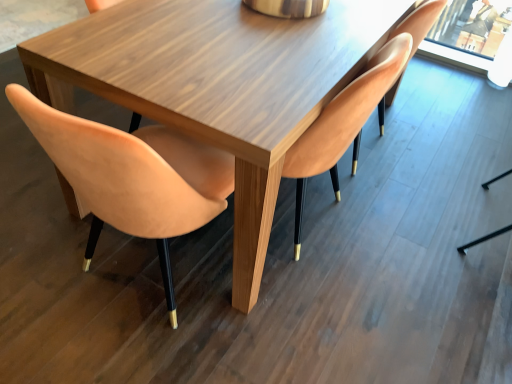
Question: Considering the relative sizes of suede-like peach chair at left, which ranks as the third chair in right-to-left order, and matte wood chair at center, the 2th chair positioned from the left, in the image provided, is suede-like peach chair at left, which ranks as the third chair in right-to-left order, taller than matte wood chair at center, the 2th chair positioned from the left,?

Choices:
 (A) no
 (B) yes

Answer: (A)

Question: Is suede-like peach chair at left, which is counted as the first chair, starting from the left, aimed at matte wood chair at center, the 2th chair positioned from the left?

Choices:
 (A) no
 (B) yes

Answer: (B)

Question: Is suede-like peach chair at left, which is counted as the first chair, starting from the left, to the right of matte wood chair at center, the 2th chair positioned from the left, from the viewer's perspective?

Choices:
 (A) no
 (B) yes

Answer: (A)

Question: Is suede-like peach chair at left, which is counted as the first chair, starting from the left, not within matte wood chair at center, the 2th chair positioned from the left?

Choices:
 (A) yes
 (B) no

Answer: (A)

Question: Does suede-like peach chair at left, which is counted as the first chair, starting from the left, have a smaller size compared to matte wood chair at center, the 2th chair positioned from the left?

Choices:
 (A) yes
 (B) no

Answer: (A)

Question: From a real-world perspective, is matte wood chair at center, the 2th chair positioned from the left, above or below suede-like peach chair at left, which is counted as the first chair, starting from the left?

Choices:
 (A) above
 (B) below

Answer: (A)

Question: Choose the correct answer: Is matte wood chair at center, which is the 2th chair from right to left, inside suede-like peach chair at left, which ranks as the third chair in right-to-left order, or outside it?

Choices:
 (A) inside
 (B) outside

Answer: (B)

Question: Considering the positions of matte wood chair at center, the 2th chair positioned from the left, and suede-like peach chair at left, which is counted as the first chair, starting from the left, in the image, is matte wood chair at center, the 2th chair positioned from the left, bigger or smaller than suede-like peach chair at left, which is counted as the first chair, starting from the left,?

Choices:
 (A) big
 (B) small

Answer: (A)

Question: In the image, is matte wood chair at center, which is the 2th chair from right to left, on the left side or the right side of suede-like peach chair at left, which is counted as the first chair, starting from the left?

Choices:
 (A) left
 (B) right

Answer: (B)

Question: From a real-world perspective, is matte orange chair at upper right, arranged as the 1th chair when viewed from the right, physically located above or below suede-like peach chair at left, which ranks as the third chair in right-to-left order?

Choices:
 (A) above
 (B) below

Answer: (B)

Question: From the image's perspective, is matte orange chair at upper right, arranged as the 1th chair when viewed from the right, above or below suede-like peach chair at left, which ranks as the third chair in right-to-left order?

Choices:
 (A) below
 (B) above

Answer: (B)

Question: Looking at their shapes, would you say matte orange chair at upper right, arranged as the 1th chair when viewed from the right, is wider or thinner than suede-like peach chair at left, which ranks as the third chair in right-to-left order?

Choices:
 (A) thin
 (B) wide

Answer: (A)

Question: Looking at the image, does matte orange chair at upper right, the 3th chair in the left-to-right sequence, seem bigger or smaller compared to suede-like peach chair at left, which is counted as the first chair, starting from the left?

Choices:
 (A) big
 (B) small

Answer: (B)

Question: Based on their sizes in the image, would you say matte wood chair at center, which is the 2th chair from right to left, is bigger or smaller than matte orange chair at upper right, the 3th chair in the left-to-right sequence?

Choices:
 (A) big
 (B) small

Answer: (A)

Question: Considering their positions, is matte wood chair at center, the 2th chair positioned from the left, located in front of or behind matte orange chair at upper right, the 3th chair in the left-to-right sequence?

Choices:
 (A) behind
 (B) front

Answer: (B)